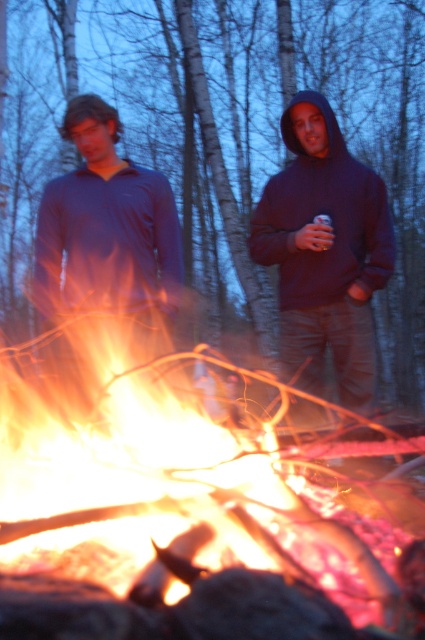
You are standing at the edge of the campfire and want to hand the metallic can at center to the person wearing the dark blue hoodie at center. Which direction should you move to reach the person?

The dark blue hoodie at center is to the left of the metallic can at center, so you should move to the left to reach the person wearing the dark blue hoodie at center.

You are a photographer trying to capture the campfire scene. You notice the dark blue hoodie at center and the metallic can at center in your frame. Which object should you focus on to ensure the closer one is sharp?

You should focus on the dark blue hoodie at center because it is closer to the viewer than the metallic can at center.